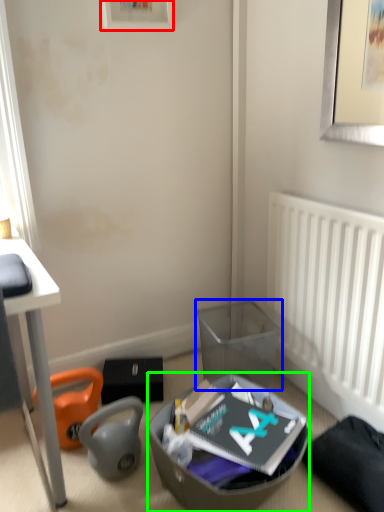
Question: Estimate the real-world distances between objects in this image. Which object is farther from picture frame (highlighted by a red box), trash bin/can (highlighted by a blue box) or shoe box (highlighted by a green box)?

Choices:
 (A) trash bin/can
 (B) shoe box

Answer: (B)